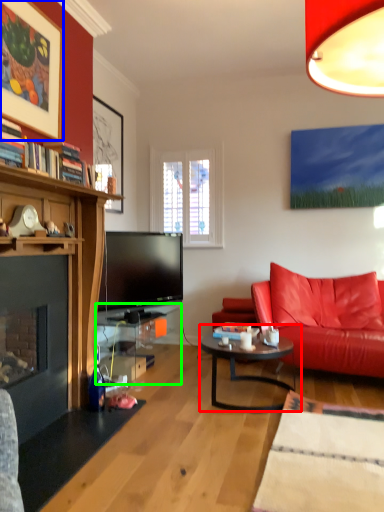
Question: Which object is positioned farthest from coffee table (highlighted by a red box)? Select from picture frame (highlighted by a blue box) and table (highlighted by a green box).

Choices:
 (A) picture frame
 (B) table

Answer: (A)